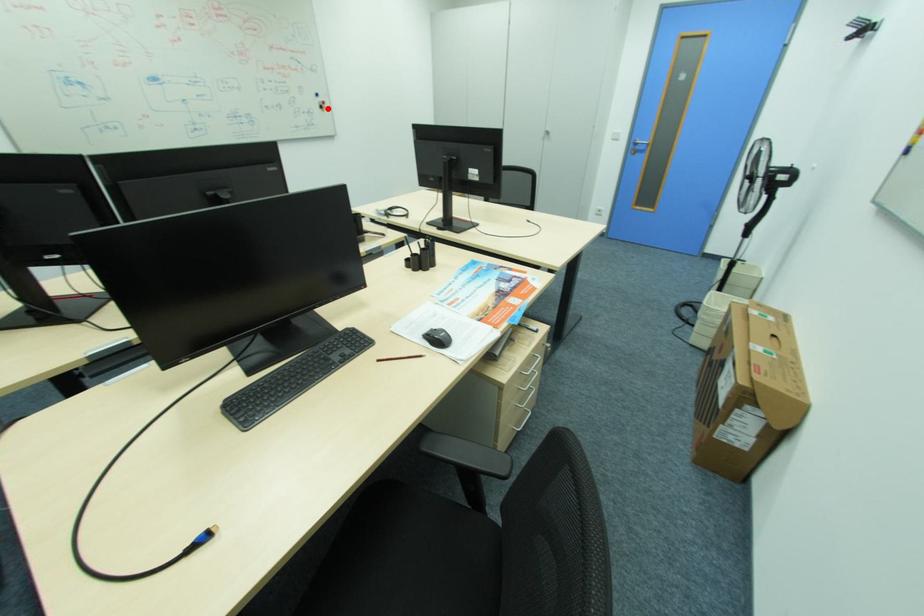
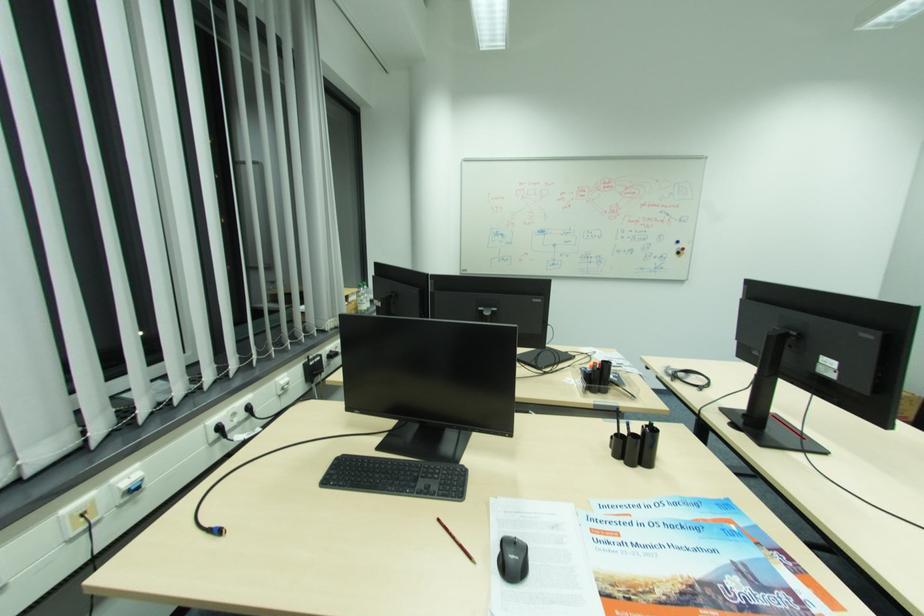
In the second image, find the point that corresponds to the highlighted location in the first image.

(684, 253)